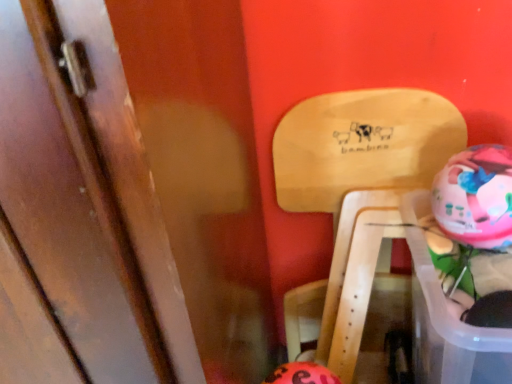
What is the approximate width of natural wood chair at upper right?

natural wood chair at upper right is 22.38 centimeters wide.

The height and width of the screenshot is (384, 512). Identify the location of multicolored plastic piggy bank at right, arranged as the first piggy bank when viewed from the right. (476, 197).

Considering the sizes of objects orange matte piggy bank at lower center, which is the 2th piggy bank in right-to-left order, and multicolored plastic piggy bank at right, which is counted as the 1th piggy bank, starting from the top, in the image provided, who is bigger, orange matte piggy bank at lower center, which is the 2th piggy bank in right-to-left order, or multicolored plastic piggy bank at right, which is counted as the 1th piggy bank, starting from the top,?

With larger size is orange matte piggy bank at lower center, which is the 2th piggy bank in right-to-left order.

Is orange matte piggy bank at lower center, the first piggy bank ordered from the bottom, shorter than multicolored plastic piggy bank at right, which is the 2th piggy bank in bottom-to-top order?

No.

Is orange matte piggy bank at lower center, the 1th piggy bank when ordered from left to right, facing away from multicolored plastic piggy bank at right, which is counted as the 1th piggy bank, starting from the top?

orange matte piggy bank at lower center, the 1th piggy bank when ordered from left to right, does not have its back to multicolored plastic piggy bank at right, which is counted as the 1th piggy bank, starting from the top.

At what (x,y) coordinates should I click in order to perform the action: click on piggy bank above the orange matte piggy bank at lower center, which is the 2th piggy bank in right-to-left order (from the image's perspective). Please return your answer as a coordinate pair (x, y). Looking at the image, I should click on (476, 197).

Is wooden door at left smaller than natural wood chair at upper right?

No.

Which object is positioned more to the right, wooden door at left or natural wood chair at upper right?

From the viewer's perspective, natural wood chair at upper right appears more on the right side.

Could you tell me if wooden door at left is facing natural wood chair at upper right?

No, wooden door at left is not turned towards natural wood chair at upper right.

Measure the distance from wooden door at left to natural wood chair at upper right.

wooden door at left is 23.96 inches away from natural wood chair at upper right.

Who is taller, orange matte piggy bank at lower center, the 1th piggy bank when ordered from left to right, or wooden door at left?

With more height is wooden door at left.

Does point (282, 375) lie behind point (52, 151)?

Yes, it is.

Looking at their sizes, would you say orange matte piggy bank at lower center, the first piggy bank ordered from the bottom, is wider or thinner than wooden door at left?

Considering their sizes, orange matte piggy bank at lower center, the first piggy bank ordered from the bottom, looks slimmer than wooden door at left.

Which of these two, multicolored plastic piggy bank at right, which is the 2th piggy bank in bottom-to-top order, or wooden door at left, is smaller?

multicolored plastic piggy bank at right, which is the 2th piggy bank in bottom-to-top order.

Are multicolored plastic piggy bank at right, arranged as the first piggy bank when viewed from the right, and wooden door at left located far from each other?

That's not correct — multicolored plastic piggy bank at right, arranged as the first piggy bank when viewed from the right, is a little close to wooden door at left.

From a real-world perspective, is multicolored plastic piggy bank at right, which is counted as the 1th piggy bank, starting from the top, physically below wooden door at left?

No, from a real-world perspective, multicolored plastic piggy bank at right, which is counted as the 1th piggy bank, starting from the top, is not under wooden door at left.

Is multicolored plastic piggy bank at right, which is counted as the 1th piggy bank, starting from the top, oriented away from orange matte piggy bank at lower center, the 1th piggy bank when ordered from left to right?

No, orange matte piggy bank at lower center, the 1th piggy bank when ordered from left to right, is not at the back of multicolored plastic piggy bank at right, which is counted as the 1th piggy bank, starting from the top.

From a real-world perspective, is multicolored plastic piggy bank at right, which is counted as the 1th piggy bank, starting from the top, below orange matte piggy bank at lower center, the 1th piggy bank when ordered from left to right?

Incorrect, from a real-world perspective, multicolored plastic piggy bank at right, which is counted as the 1th piggy bank, starting from the top, is higher than orange matte piggy bank at lower center, the 1th piggy bank when ordered from left to right.

Based on their sizes in the image, would you say multicolored plastic piggy bank at right, which is the 2th piggy bank in bottom-to-top order, is bigger or smaller than orange matte piggy bank at lower center, the 1th piggy bank when ordered from left to right?

Clearly, multicolored plastic piggy bank at right, which is the 2th piggy bank in bottom-to-top order, is smaller in size than orange matte piggy bank at lower center, the 1th piggy bank when ordered from left to right.

Between wooden door at left and multicolored plastic piggy bank at right, which is counted as the 1th piggy bank, starting from the top, which one has smaller width?

Thinner between the two is multicolored plastic piggy bank at right, which is counted as the 1th piggy bank, starting from the top.

Is wooden door at left aimed at multicolored plastic piggy bank at right, which is counted as the 1th piggy bank, starting from the top?

No.

From the image's perspective, is wooden door at left located beneath multicolored plastic piggy bank at right, the 2th piggy bank from the left?

Indeed, from the image's perspective, wooden door at left is shown beneath multicolored plastic piggy bank at right, the 2th piggy bank from the left.

Considering the points (86, 334) and (445, 226), which point is in front, point (86, 334) or point (445, 226)?

The point (86, 334) is closer.

From a real-world perspective, is multicolored plastic piggy bank at right, the 2th piggy bank from the left, under natural wood chair at upper right?

Actually, multicolored plastic piggy bank at right, the 2th piggy bank from the left, is physically above natural wood chair at upper right in the real world.

Does multicolored plastic piggy bank at right, arranged as the first piggy bank when viewed from the right, come behind natural wood chair at upper right?

A: No, multicolored plastic piggy bank at right, arranged as the first piggy bank when viewed from the right, is in front of natural wood chair at upper right.

Looking at this image, from the image's perspective, would you say multicolored plastic piggy bank at right, which is the 2th piggy bank in bottom-to-top order, is positioned over natural wood chair at upper right?

Correct, multicolored plastic piggy bank at right, which is the 2th piggy bank in bottom-to-top order, appears higher than natural wood chair at upper right in the image.

Locate an element on the screen. This screenshot has width=512, height=384. piggy bank below the multicolored plastic piggy bank at right, which is counted as the 1th piggy bank, starting from the top (from the image's perspective) is located at coordinates (302, 374).

Image resolution: width=512 pixels, height=384 pixels. I want to click on furniture that is above the wooden door at left (from the image's perspective), so click(x=359, y=159).

From the image, which object appears to be farther from orange matte piggy bank at lower center, which is the 2th piggy bank in right-to-left order, wooden door at left or multicolored plastic piggy bank at right, which is the 2th piggy bank in bottom-to-top order?

Among the two, wooden door at left is located further to orange matte piggy bank at lower center, which is the 2th piggy bank in right-to-left order.

Based on the photo, estimate the real-world distances between objects in this image. Which object is closer to multicolored plastic piggy bank at right, arranged as the first piggy bank when viewed from the right, orange matte piggy bank at lower center, which is the 2th piggy bank in right-to-left order, or wooden door at left?

orange matte piggy bank at lower center, which is the 2th piggy bank in right-to-left order, lies closer to multicolored plastic piggy bank at right, arranged as the first piggy bank when viewed from the right, than the other object.

When comparing their distances from wooden door at left, does multicolored plastic piggy bank at right, arranged as the first piggy bank when viewed from the right, or orange matte piggy bank at lower center, which is the 2th piggy bank in right-to-left order, seem further?

Among the two, multicolored plastic piggy bank at right, arranged as the first piggy bank when viewed from the right, is located further to wooden door at left.

Which object lies nearer to the anchor point orange matte piggy bank at lower center, which appears as the 2th piggy bank when viewed from the top, natural wood chair at upper right or multicolored plastic piggy bank at right, which is counted as the 1th piggy bank, starting from the top?

multicolored plastic piggy bank at right, which is counted as the 1th piggy bank, starting from the top, lies closer to orange matte piggy bank at lower center, which appears as the 2th piggy bank when viewed from the top, than the other object.

From the picture: Looking at the image, which one is located further to wooden door at left, orange matte piggy bank at lower center, which is the 2th piggy bank in right-to-left order, or natural wood chair at upper right?

natural wood chair at upper right lies further to wooden door at left than the other object.

Based on their spatial positions, is natural wood chair at upper right or wooden door at left closer to orange matte piggy bank at lower center, the 1th piggy bank when ordered from left to right?

natural wood chair at upper right is positioned closer to the anchor orange matte piggy bank at lower center, the 1th piggy bank when ordered from left to right.

Estimate the real-world distances between objects in this image. Which object is further from orange matte piggy bank at lower center, the first piggy bank ordered from the bottom, wooden door at left or natural wood chair at upper right?

Based on the image, wooden door at left appears to be further to orange matte piggy bank at lower center, the first piggy bank ordered from the bottom.

From the picture: Looking at the image, which one is located further to natural wood chair at upper right, orange matte piggy bank at lower center, which is the 2th piggy bank in right-to-left order, or wooden door at left?

wooden door at left is further to natural wood chair at upper right.

Identify the location of furniture between wooden door at left and multicolored plastic piggy bank at right, the 2th piggy bank from the left, in the horizontal direction. (359, 159).

The image size is (512, 384). What are the coordinates of `furniture located between wooden door at left and orange matte piggy bank at lower center, which is the 2th piggy bank in right-to-left order, in the depth direction` in the screenshot? It's located at (359, 159).

This screenshot has height=384, width=512. I want to click on piggy bank located between wooden door at left and multicolored plastic piggy bank at right, which is the 2th piggy bank in bottom-to-top order, in the left-right direction, so click(x=302, y=374).

Locate an element on the screen. The width and height of the screenshot is (512, 384). furniture that lies between multicolored plastic piggy bank at right, arranged as the first piggy bank when viewed from the right, and orange matte piggy bank at lower center, the first piggy bank ordered from the bottom, from top to bottom is located at coordinates (359, 159).